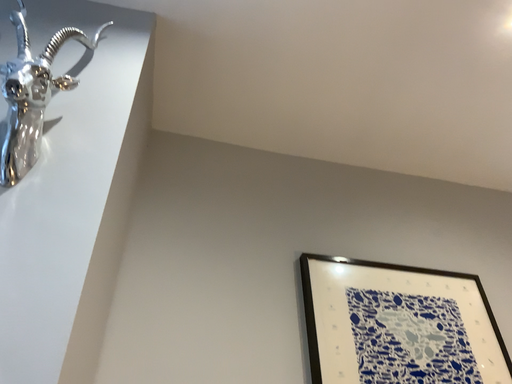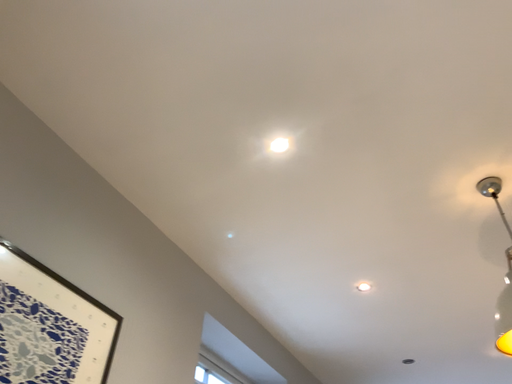
Question: Which way did the camera rotate in the video?

Choices:
 (A) rotated left
 (B) rotated right

Answer: (B)